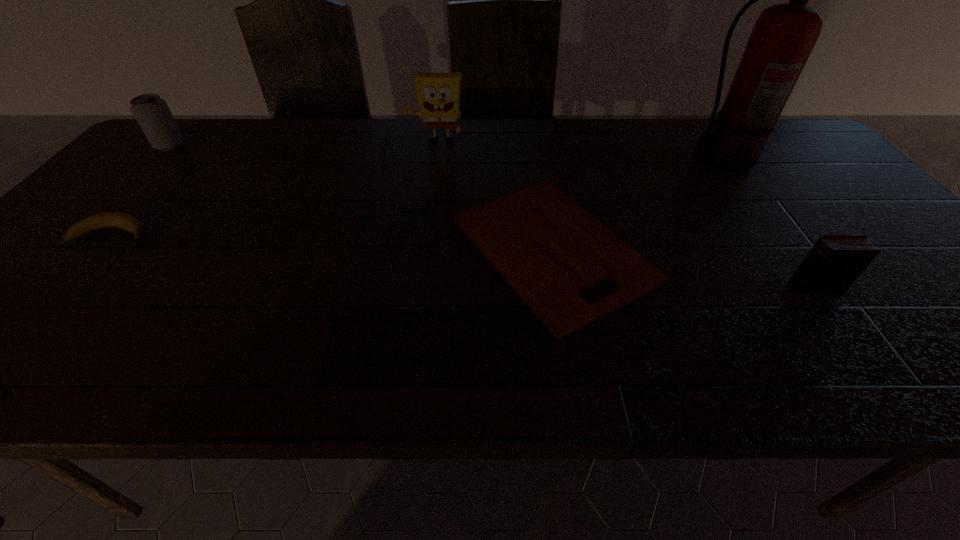
Identify the location of vacant space that is in between the tallest object and the can. The image size is (960, 540). (446, 152).

At what (x,y) coordinates should I click in order to perform the action: click on free space between the banana and the chopping board. Please return your answer as a coordinate pair (x, y). This screenshot has height=540, width=960. Looking at the image, I should click on point(333,242).

Find the location of a particular element. free spot between the fifth shortest object and the shortest object is located at coordinates click(x=493, y=197).

This screenshot has height=540, width=960. I want to click on vacant region between the chopping board and the tallest object, so click(637, 204).

Where is `free space between the fifth tallest object and the third shortest object`? free space between the fifth tallest object and the third shortest object is located at coordinates (464, 261).

Where is `vacant space that's between the banana and the sponge`? This screenshot has width=960, height=540. vacant space that's between the banana and the sponge is located at coordinates (275, 190).

I want to click on object that ranks as the third closest to the chopping board, so pos(833,264).

Point out which object is positioned as the third nearest to the shortest object. Please provide its 2D coordinates. Your answer should be formatted as a tuple, i.e. [(x, y)], where the tuple contains the x and y coordinates of a point satisfying the conditions above.

[(833, 264)]